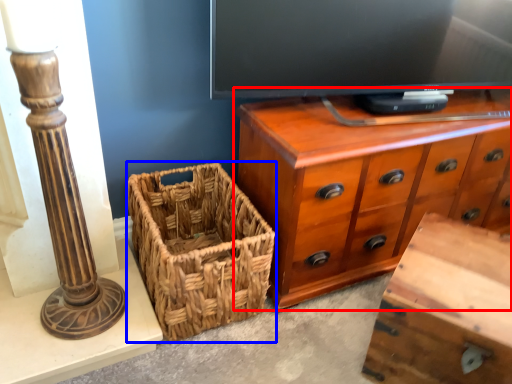
Question: Which point is closer to the camera, chest of drawers (highlighted by a red box) or picnic basket (highlighted by a blue box)?

Choices:
 (A) chest of drawers
 (B) picnic basket

Answer: (B)